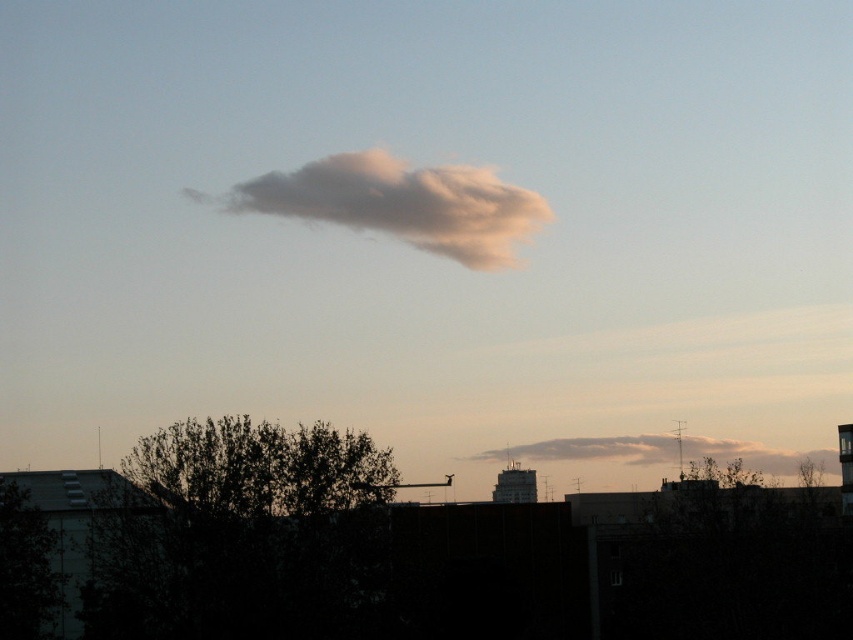
Is dark green leafy tree at lower center wider than fuzzy white cloud at center?

Incorrect, dark green leafy tree at lower center's width does not surpass fuzzy white cloud at center's.

Describe the element at coordinates (247, 536) in the screenshot. The height and width of the screenshot is (640, 853). I see `dark green leafy tree at lower center` at that location.

Is point (354, 532) farther from viewer compared to point (763, 464)?

No, it is in front of (763, 464).

Where is `dark green leafy tree at lower center`? dark green leafy tree at lower center is located at coordinates (247, 536).

Does fuzzy white cloud at upper center lie in front of fuzzy white cloud at center?

Yes, fuzzy white cloud at upper center is in front of fuzzy white cloud at center.

Between fuzzy white cloud at upper center and fuzzy white cloud at center, which one has more height?

fuzzy white cloud at upper center

Locate an element on the screen. This screenshot has height=640, width=853. fuzzy white cloud at upper center is located at coordinates (399, 204).

Can you confirm if dark green leafy tree at lower center is positioned below fuzzy white cloud at upper center?

Yes.

Does point (169, 488) come in front of point (509, 248)?

Yes, it is in front of point (509, 248).

Identify the location of dark green leafy tree at lower center. This screenshot has height=640, width=853. (247, 536).